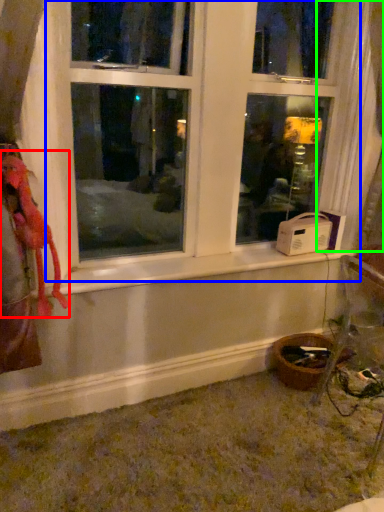
Question: Considering the real-world distances, which object is farthest from animal (highlighted by a red box)? window (highlighted by a blue box) or curtain (highlighted by a green box)?

Choices:
 (A) window
 (B) curtain

Answer: (B)